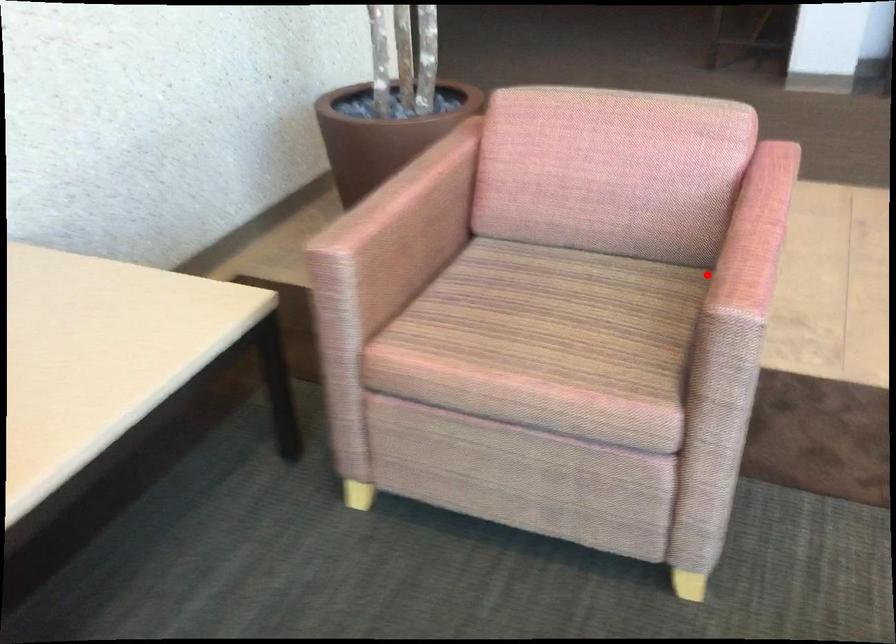
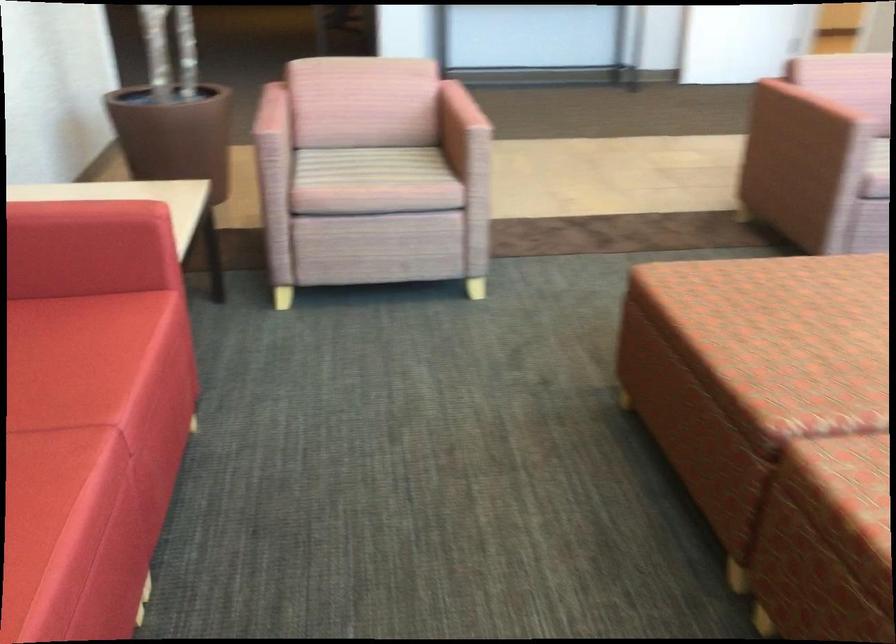
Question: I am providing you with two images of the same scene from different viewpoints. In image1, a red point is highlighted. Considering the same 3D point in image2, which of the following is correct?

Choices:
 (A) It is closer
 (B) It is farther

Answer: (B)